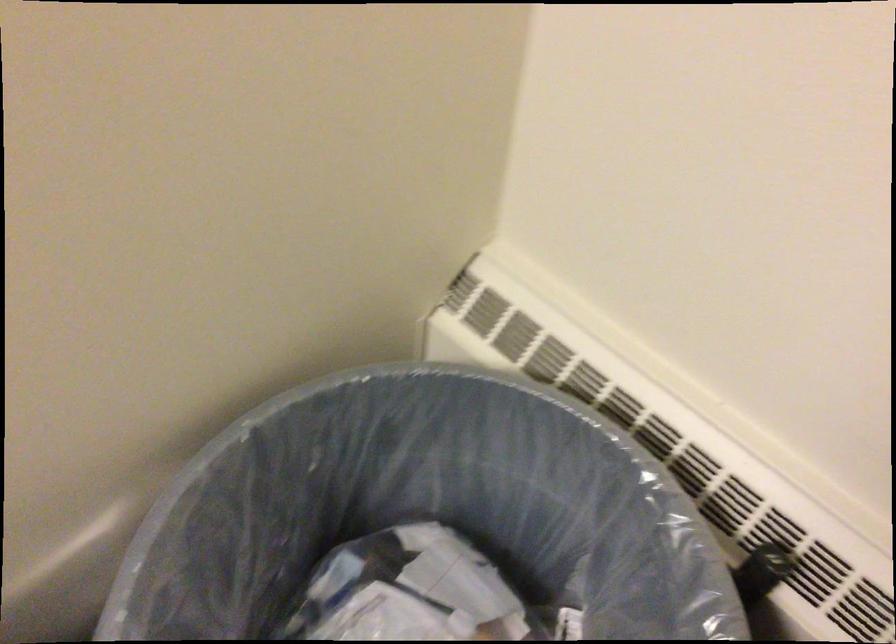
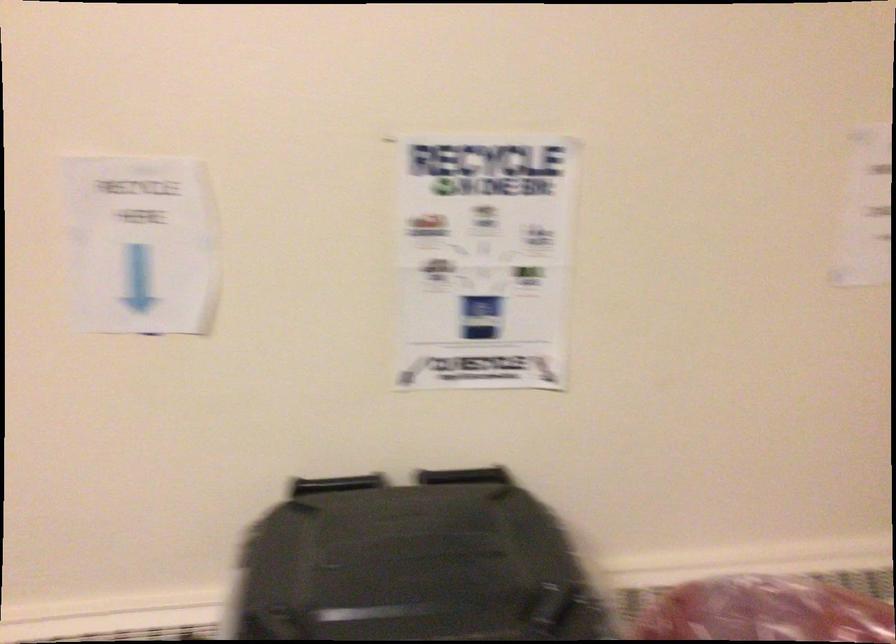
Question: Based on the continuous images, in which direction is the camera rotating? Reply with the corresponding letter.

Choices:
 (A) Left
 (B) Right
 (C) Up
 (D) Down

Answer: (B)